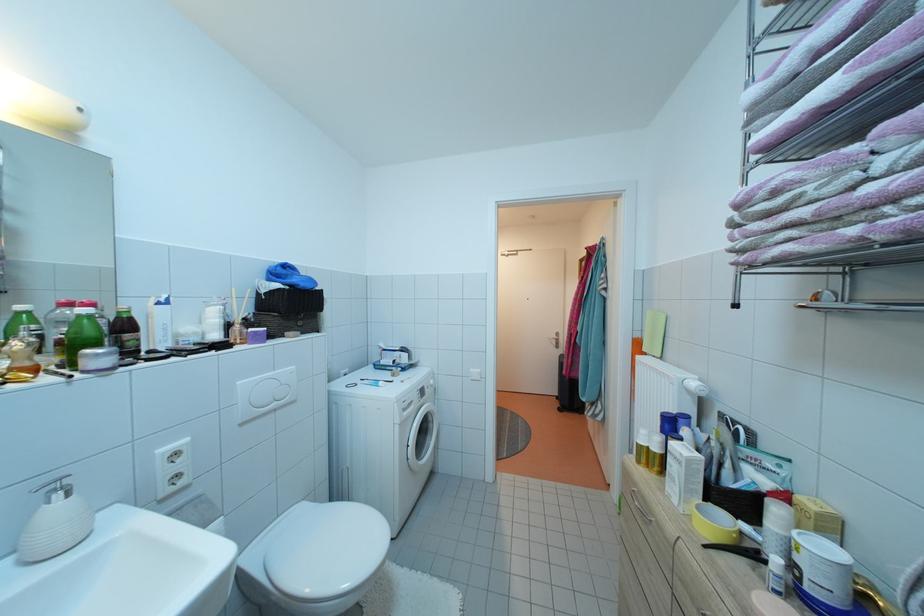
Find where to pull the washing machine handle. Please return your answer as a coordinate pair (x, y).

(405, 406)